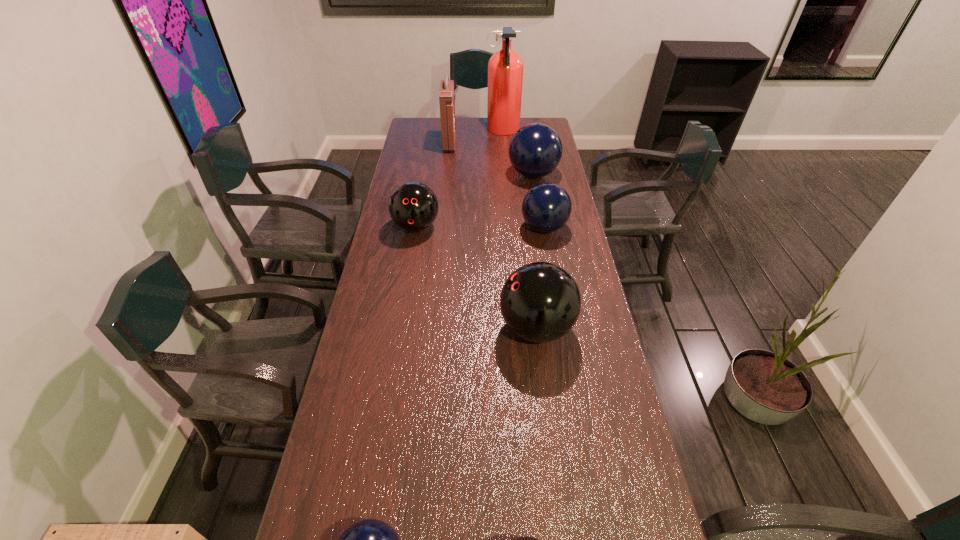
You are a GUI agent. You are given a task and a screenshot of the screen. Output one action in this format:
    pyautogui.click(x=<x>, y=<y>)
    Task: Click on the fire extinguisher
    This screenshot has height=540, width=960.
    Given the screenshot: What is the action you would take?
    pyautogui.click(x=505, y=68)

You are a GUI agent. You are given a task and a screenshot of the screen. Output one action in this format:
    pyautogui.click(x=<x>, y=<y>)
    Task: Click on the second tallest object
    The image size is (960, 540).
    Given the screenshot: What is the action you would take?
    pyautogui.click(x=446, y=92)

This screenshot has height=540, width=960. Find the location of `the first-aid kit`. the first-aid kit is located at coordinates (446, 92).

Identify the location of the third farthest object. This screenshot has height=540, width=960. (535, 150).

The image size is (960, 540). I want to click on the farthest bowling ball, so point(535,150).

This screenshot has width=960, height=540. In order to click on the second farthest black bowling ball in this screenshot , I will do `click(540, 302)`.

Locate an element on the screen. This screenshot has width=960, height=540. the biggest black bowling ball is located at coordinates (540, 302).

You are a GUI agent. You are given a task and a screenshot of the screen. Output one action in this format:
    pyautogui.click(x=<x>, y=<y>)
    Task: Click on the leftmost black bowling ball
    This screenshot has height=540, width=960.
    Given the screenshot: What is the action you would take?
    pyautogui.click(x=413, y=206)

This screenshot has height=540, width=960. I want to click on the farthest black bowling ball, so click(413, 206).

Find the location of a particular element. The width and height of the screenshot is (960, 540). the second nearest blue bowling ball is located at coordinates (546, 207).